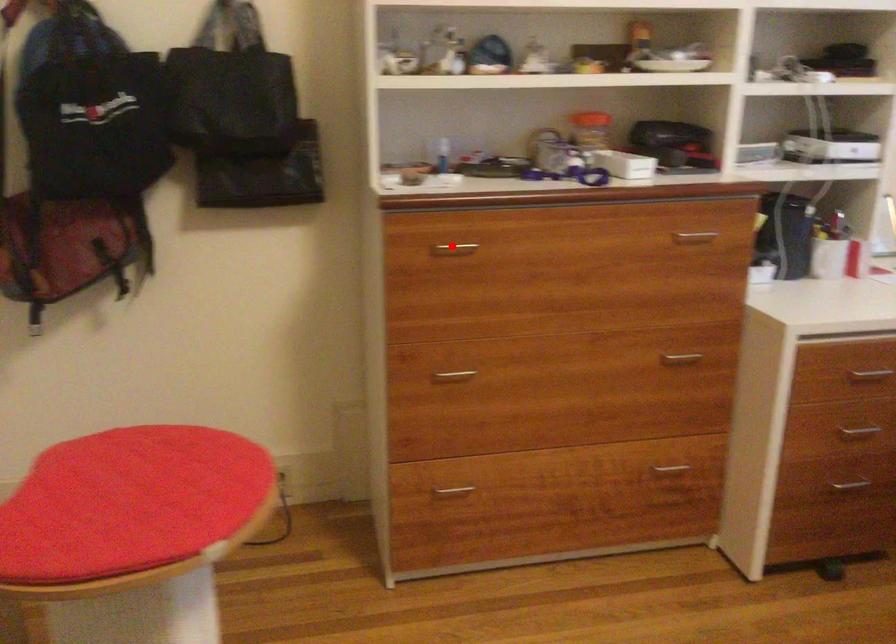
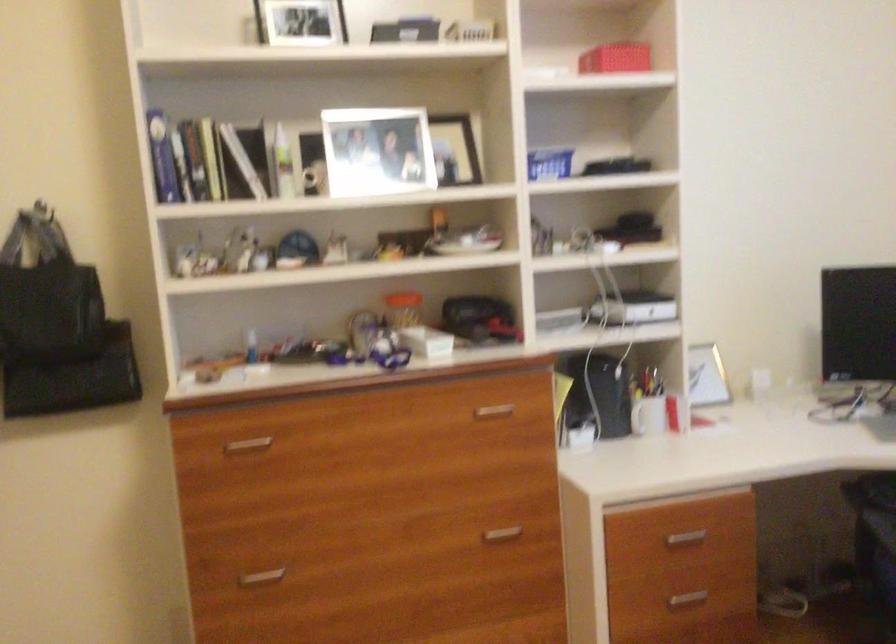
In the second image, find the point that corresponds to the highlighted location in the first image.

(247, 444)